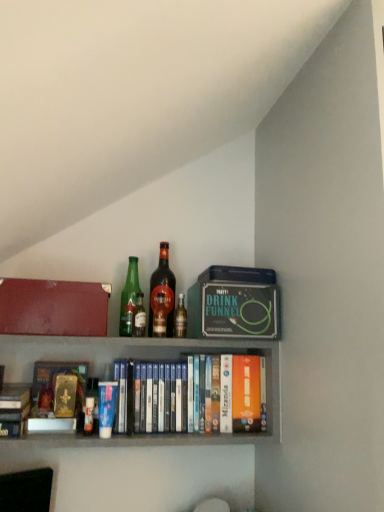
Question: Should I look upward or downward to see matte red box at upper left?

Choices:
 (A) down
 (B) up

Answer: (A)

Question: Is brown glass bottle at center, acting as the 3th bottle starting from the left, completely or partially inside matte black drink funnel at upper center, which is the first paperback book in back-to-front order?

Choices:
 (A) no
 (B) yes

Answer: (A)

Question: Is matte black drink funnel at upper center, arranged as the first paperback book when viewed from the right, wider than brown glass bottle at center, the 2th bottle in the right-to-left sequence?

Choices:
 (A) yes
 (B) no

Answer: (A)

Question: Is matte black drink funnel at upper center, the second paperback book from the front, at the right side of brown glass bottle at center, acting as the 3th bottle starting from the left?

Choices:
 (A) no
 (B) yes

Answer: (B)

Question: Can you confirm if matte black drink funnel at upper center, the second paperback book positioned from the left, is smaller than brown glass bottle at center, acting as the 3th bottle starting from the left?

Choices:
 (A) no
 (B) yes

Answer: (A)

Question: Is matte black drink funnel at upper center, which is the first paperback book in back-to-front order, outside brown glass bottle at center, the 2th bottle in the right-to-left sequence?

Choices:
 (A) yes
 (B) no

Answer: (A)

Question: From the image's perspective, is matte black drink funnel at upper center, arranged as the first paperback book when viewed from the right, above brown glass bottle at center, acting as the 3th bottle starting from the left?

Choices:
 (A) no
 (B) yes

Answer: (A)

Question: Is translucent glass bottle at center, which is counted as the 4th bottle, starting from the left, behind green glass bottle at center, which is the 2th bottle in left-to-right order?

Choices:
 (A) yes
 (B) no

Answer: (A)

Question: Considering the relative sizes of translucent glass bottle at center, the first bottle when ordered from right to left, and green glass bottle at center, which is the 2th bottle in left-to-right order, in the image provided, is translucent glass bottle at center, the first bottle when ordered from right to left, taller than green glass bottle at center, which is the 2th bottle in left-to-right order,?

Choices:
 (A) no
 (B) yes

Answer: (A)

Question: Does translucent glass bottle at center, the first bottle when ordered from right to left, appear on the right side of green glass bottle at center, the third bottle positioned from the right?

Choices:
 (A) yes
 (B) no

Answer: (A)

Question: Can you confirm if translucent glass bottle at center, the first bottle when ordered from right to left, is smaller than green glass bottle at center, which is the 2th bottle in left-to-right order?

Choices:
 (A) no
 (B) yes

Answer: (A)

Question: Is translucent glass bottle at center, the first bottle when ordered from right to left, outside of green glass bottle at center, which is the 2th bottle in left-to-right order?

Choices:
 (A) yes
 (B) no

Answer: (A)

Question: From a real-world perspective, is translucent glass bottle at center, which is counted as the 4th bottle, starting from the left, physically above green glass bottle at center, which is the 2th bottle in left-to-right order?

Choices:
 (A) no
 (B) yes

Answer: (B)

Question: Is green glass bottle at center, which is the first bottle in left-to-right order, at the left side of wooden books at center?

Choices:
 (A) yes
 (B) no

Answer: (A)